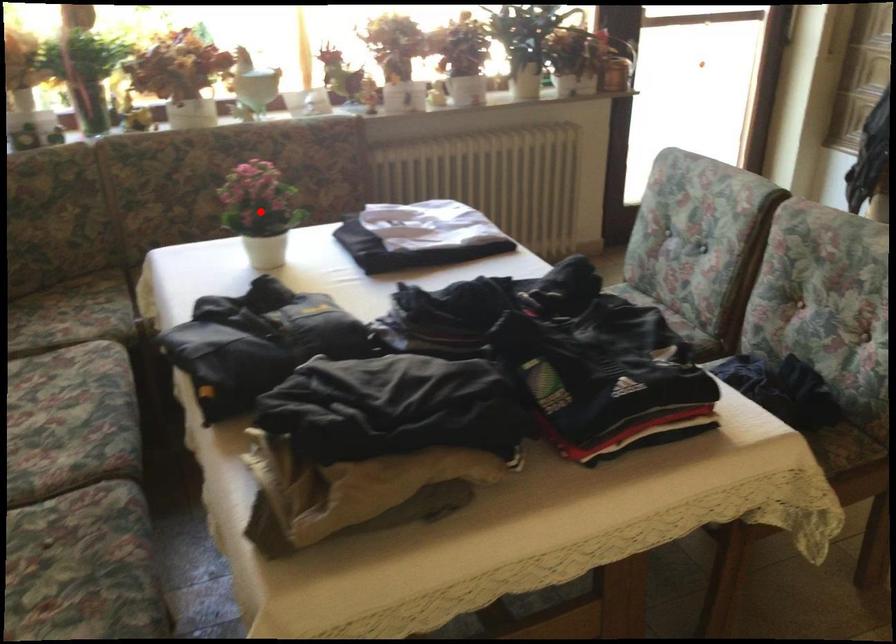
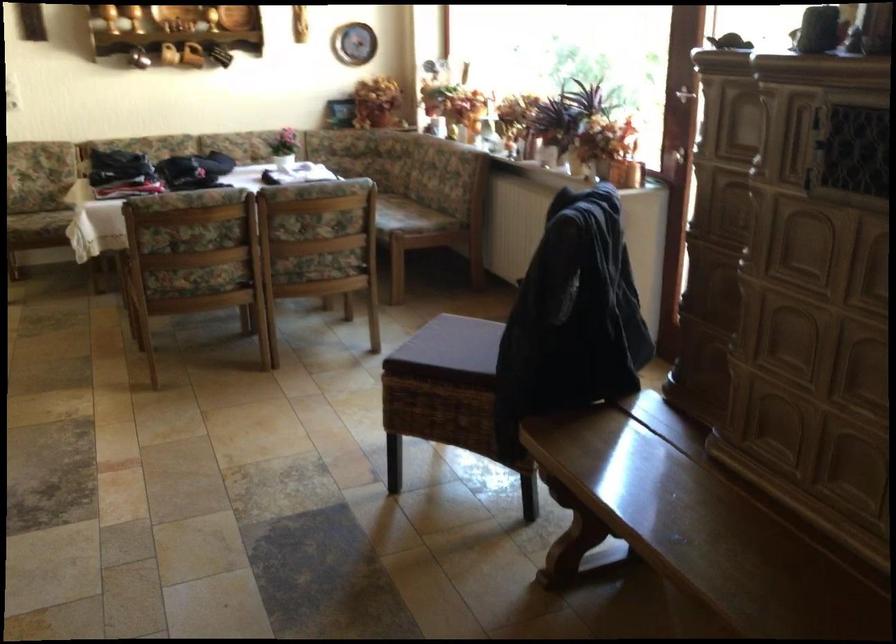
Question: I am providing you with two images of the same scene from different viewpoints. A red point is marked on the first image. Can you still see the location of the red point in image 2?

Choices:
 (A) Yes
 (B) No

Answer: (B)